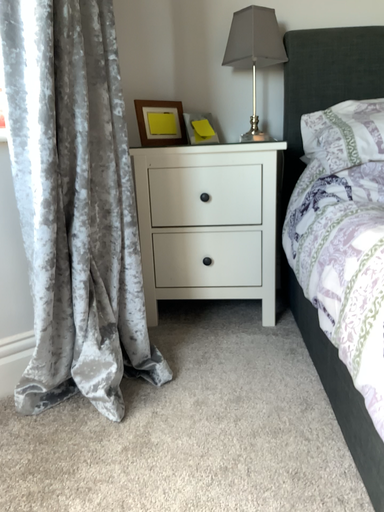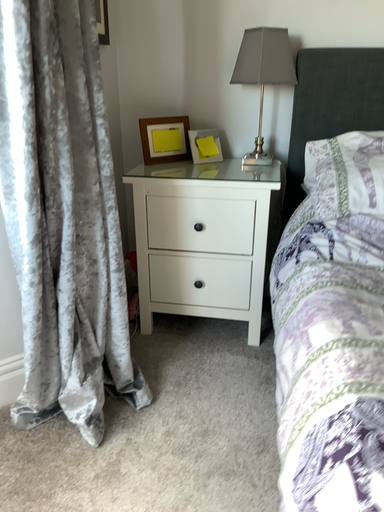
Question: Which way did the camera rotate in the video?

Choices:
 (A) rotated upward
 (B) rotated downward

Answer: (B)